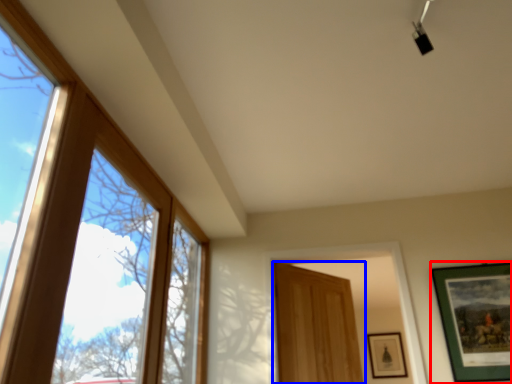
Question: Which of the following is the closest to the observer, picture frame (highlighted by a red box) or door (highlighted by a blue box)?

Choices:
 (A) picture frame
 (B) door

Answer: (A)